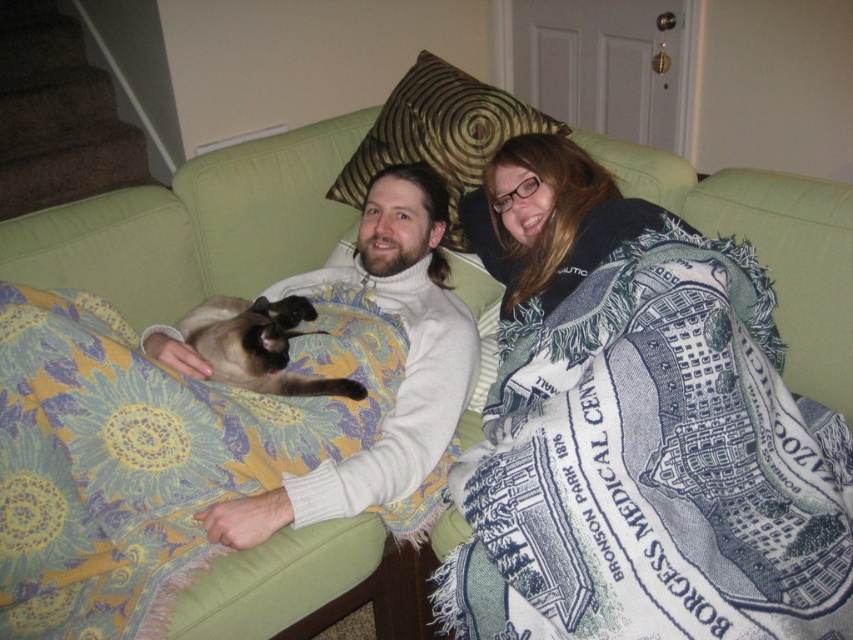
Between yellow floral fabric at left and blue woven blanket at upper right, which one is positioned lower?

yellow floral fabric at left is lower down.

Can you confirm if yellow floral fabric at left is positioned below blue woven blanket at upper right?

Yes, yellow floral fabric at left is below blue woven blanket at upper right.

Does point (115, 531) lie in front of point (579, 236)?

Yes.

You are a GUI agent. You are given a task and a screenshot of the screen. Output one action in this format:
    pyautogui.click(x=<x>, y=<y>)
    Task: Click on the yellow floral fabric at left
    The image size is (853, 640).
    Given the screenshot: What is the action you would take?
    pyautogui.click(x=144, y=456)

Who is positioned more to the right, blue printed blanket at upper right or green velvet pillow at upper center?

From the viewer's perspective, blue printed blanket at upper right appears more on the right side.

Which is in front, point (488, 445) or point (367, 138)?

Point (488, 445) is more forward.

You are a GUI agent. You are given a task and a screenshot of the screen. Output one action in this format:
    pyautogui.click(x=<x>, y=<y>)
    Task: Click on the blue printed blanket at upper right
    
    Given the screenshot: What is the action you would take?
    pyautogui.click(x=653, y=465)

Is yellow floral fabric at left in front of green velvet pillow at upper center?

Yes.

From the picture: Between yellow floral fabric at left and green velvet pillow at upper center, which one is positioned higher?

Positioned higher is green velvet pillow at upper center.

Does point (178, 452) lie in front of point (479, 124)?

Yes.

Image resolution: width=853 pixels, height=640 pixels. Identify the location of yellow floral fabric at left. (144, 456).